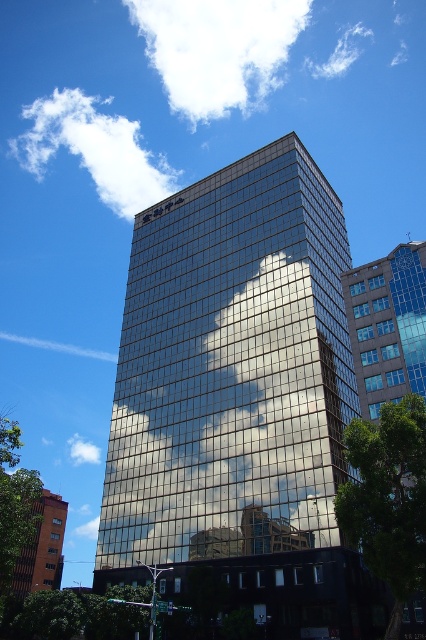
Can you confirm if reflective glass building at center is positioned to the left of white fluffy cloud at left?

In fact, reflective glass building at center is to the right of white fluffy cloud at left.

Which is behind, point (203, 193) or point (71, 353)?

Positioned behind is point (71, 353).

Where is `reflective glass building at center`? The image size is (426, 640). reflective glass building at center is located at coordinates (230, 372).

In the scene shown: Who is more forward, (46, 145) or (22, 596)?

Point (22, 596) is in front.

Is point (55, 112) closer to viewer compared to point (23, 588)?

No, it is behind (23, 588).

Locate an element on the screen. white fluffy cloud at upper left is located at coordinates (94, 148).

Looking at this image, who is more forward, (184, 22) or (25, 570)?

Point (25, 570) is in front.

Is point (206, 38) positioned before point (65, 516)?

No, it is behind (65, 516).

Is point (146, 44) positioned after point (17, 586)?

Yes, point (146, 44) is behind point (17, 586).

You are a GUI agent. You are given a task and a screenshot of the screen. Output one action in this format:
    pyautogui.click(x=<x>, y=<y>)
    Task: Click on the white fluffy cloud at upper center
    
    Given the screenshot: What is the action you would take?
    pyautogui.click(x=218, y=49)